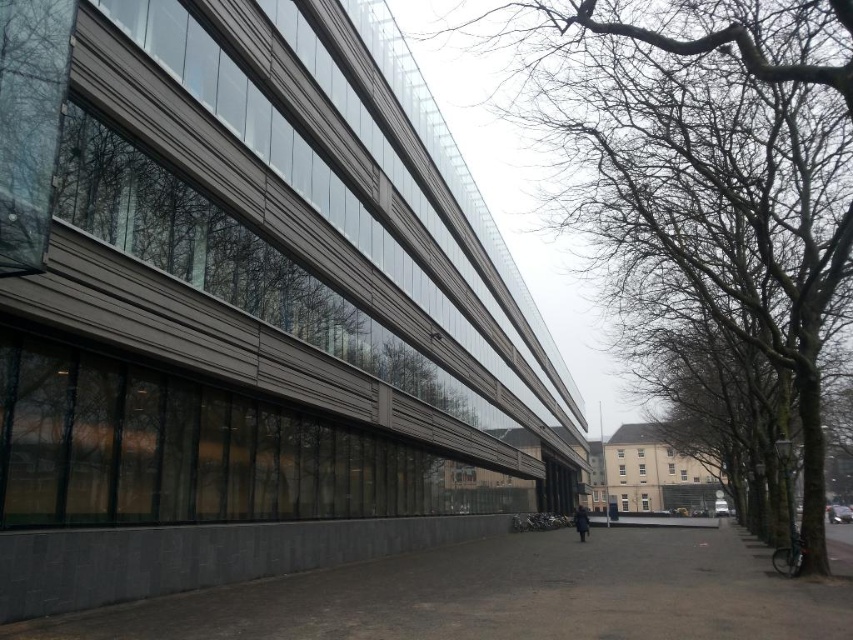
Does bare branches at upper right have a lesser height compared to dark gray coat at center?

No, bare branches at upper right is not shorter than dark gray coat at center.

Which of these two, bare branches at upper right or dark gray coat at center, stands shorter?

dark gray coat at center is shorter.

Does point (541, 120) come farther from viewer compared to point (587, 516)?

No, it is in front of (587, 516).

Where is `bare branches at upper right`? Image resolution: width=853 pixels, height=640 pixels. bare branches at upper right is located at coordinates (706, 160).